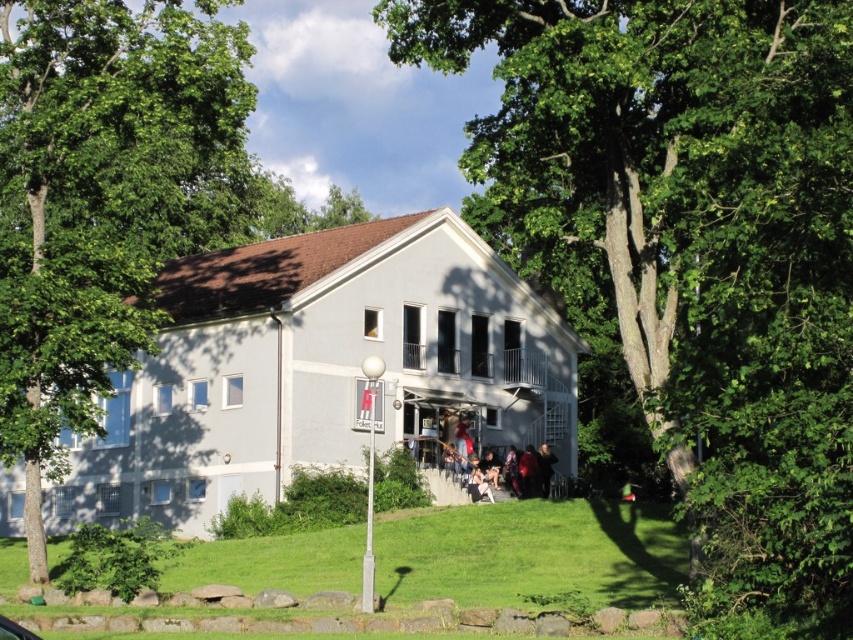
Question: Observing the image, what is the correct spatial positioning of dark brown leather jacket at lower center in reference to denim jacket at lower center?

Choices:
 (A) below
 (B) above

Answer: (B)

Question: Which point is farther from the camera taking this photo?

Choices:
 (A) (845, 328)
 (B) (686, 552)
 (C) (537, 467)

Answer: (C)

Question: Which point is closer to the camera?

Choices:
 (A) (107, 188)
 (B) (550, 456)
 (C) (521, 458)
 (D) (486, 483)

Answer: (D)

Question: Is the position of red fabric jacket at lower right less distant than that of denim jacket at lower center?

Choices:
 (A) no
 (B) yes

Answer: (A)

Question: Which of the following is the farthest from the observer?

Choices:
 (A) (90, 253)
 (B) (524, 461)
 (C) (492, 492)

Answer: (B)

Question: Is green leafy tree at upper left thinner than dark brown leather jacket at lower center?

Choices:
 (A) yes
 (B) no

Answer: (B)